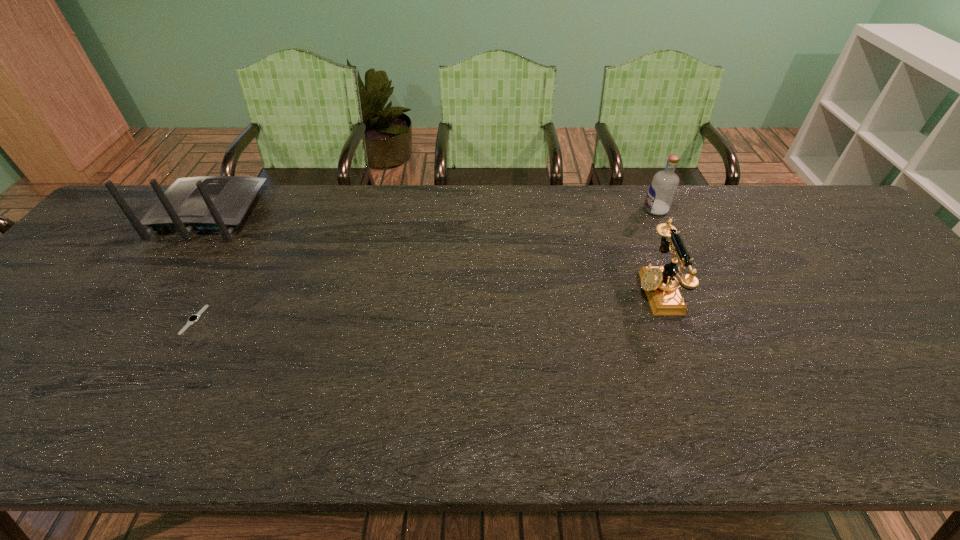
Locate an element on the screen. The height and width of the screenshot is (540, 960). the closest object relative to the third object from left to right is located at coordinates (663, 187).

Select which object appears as the closest to the shortest object. Please provide its 2D coordinates. Your answer should be formatted as a tuple, i.e. [(x, y)], where the tuple contains the x and y coordinates of a point satisfying the conditions above.

[(207, 203)]

This screenshot has height=540, width=960. In order to click on free location that satisfies the following two spatial constraints: 1. on the label of the rightmost object; 2. on the front side of the watch in this screenshot , I will do `click(706, 320)`.